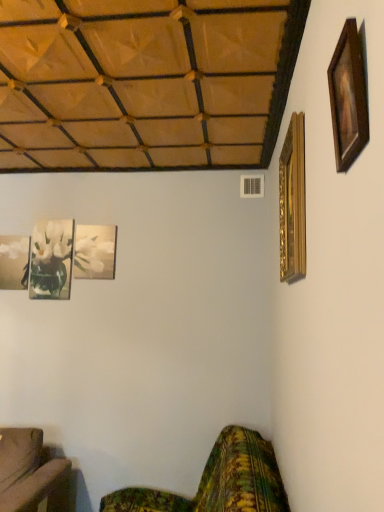
Question: Considering the relative sizes of gold ornate picture frame at upper right, acting as the 5th picture frame starting from the left, and green floral fabric couch at lower right in the image provided, is gold ornate picture frame at upper right, acting as the 5th picture frame starting from the left, shorter than green floral fabric couch at lower right?

Choices:
 (A) yes
 (B) no

Answer: (A)

Question: Can you confirm if gold ornate picture frame at upper right, acting as the 5th picture frame starting from the left, is wider than green floral fabric couch at lower right?

Choices:
 (A) no
 (B) yes

Answer: (A)

Question: Is green floral fabric couch at lower right inside gold ornate picture frame at upper right, the second picture frame positioned from the front?

Choices:
 (A) no
 (B) yes

Answer: (A)

Question: Is gold ornate picture frame at upper right, which is the fourth picture frame from back to front, outside of green floral fabric couch at lower right?

Choices:
 (A) no
 (B) yes

Answer: (B)

Question: Considering the relative sizes of gold ornate picture frame at upper right, the second picture frame positioned from the front, and green floral fabric couch at lower right in the image provided, is gold ornate picture frame at upper right, the second picture frame positioned from the front, bigger than green floral fabric couch at lower right?

Choices:
 (A) yes
 (B) no

Answer: (B)

Question: From a real-world perspective, is gold ornate picture frame at upper right, the second picture frame positioned from the front, beneath green floral fabric couch at lower right?

Choices:
 (A) yes
 (B) no

Answer: (B)

Question: Is matte glass picture frame at lower left, which ranks as the 4th picture frame in right-to-left order, smaller than green floral fabric couch at lower right?

Choices:
 (A) yes
 (B) no

Answer: (A)

Question: Can you confirm if matte glass picture frame at lower left, which ranks as the 4th picture frame in right-to-left order, is thinner than green floral fabric couch at lower right?

Choices:
 (A) no
 (B) yes

Answer: (B)

Question: Is matte glass picture frame at lower left, which ranks as the 4th picture frame in right-to-left order, taller than green floral fabric couch at lower right?

Choices:
 (A) yes
 (B) no

Answer: (B)

Question: Is matte glass picture frame at lower left, which ranks as the 4th picture frame in right-to-left order, far from green floral fabric couch at lower right?

Choices:
 (A) yes
 (B) no

Answer: (A)

Question: Is matte glass picture frame at lower left, which ranks as the 4th picture frame in right-to-left order, touching green floral fabric couch at lower right?

Choices:
 (A) no
 (B) yes

Answer: (A)

Question: From a real-world perspective, is matte glass picture frame at lower left, which ranks as the 4th picture frame in right-to-left order, on green floral fabric couch at lower right?

Choices:
 (A) yes
 (B) no

Answer: (A)

Question: Considering the relative positions of wooden picture frame at upper right, which is counted as the fourth picture frame, starting from the left, and green floral fabric couch at lower right in the image provided, is wooden picture frame at upper right, which is counted as the fourth picture frame, starting from the left, in front of green floral fabric couch at lower right?

Choices:
 (A) no
 (B) yes

Answer: (B)